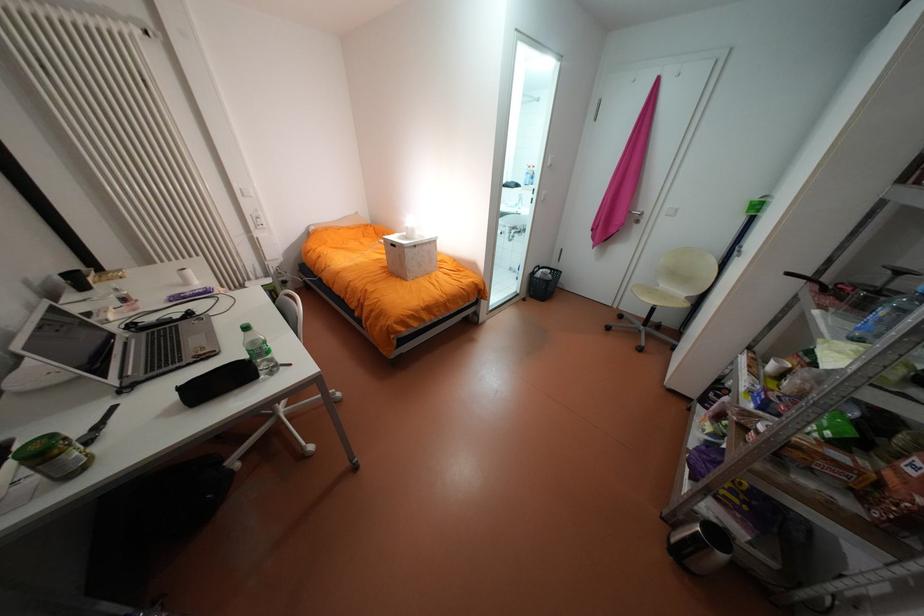
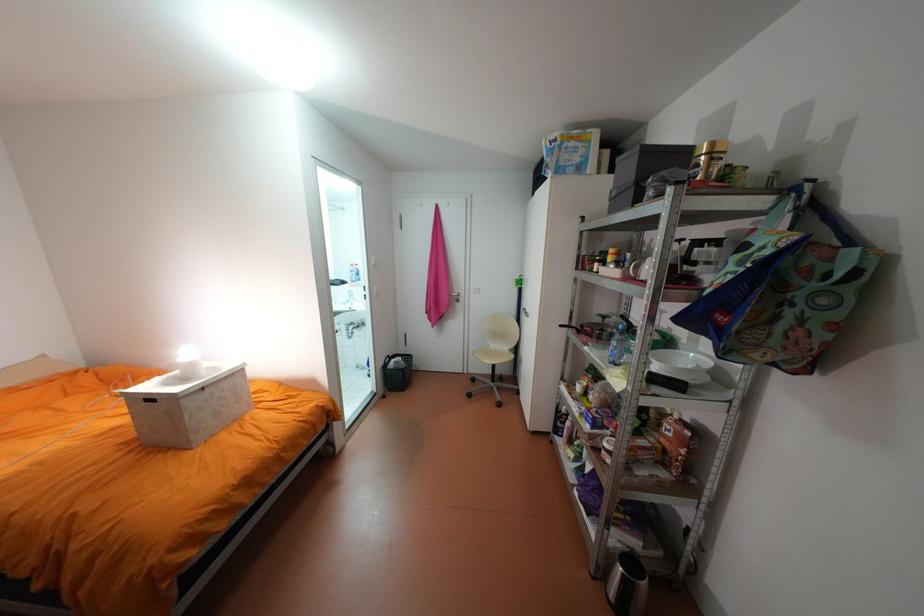
Locate, in the second image, the point that corresponds to (x=551, y=270) in the first image.

(402, 360)